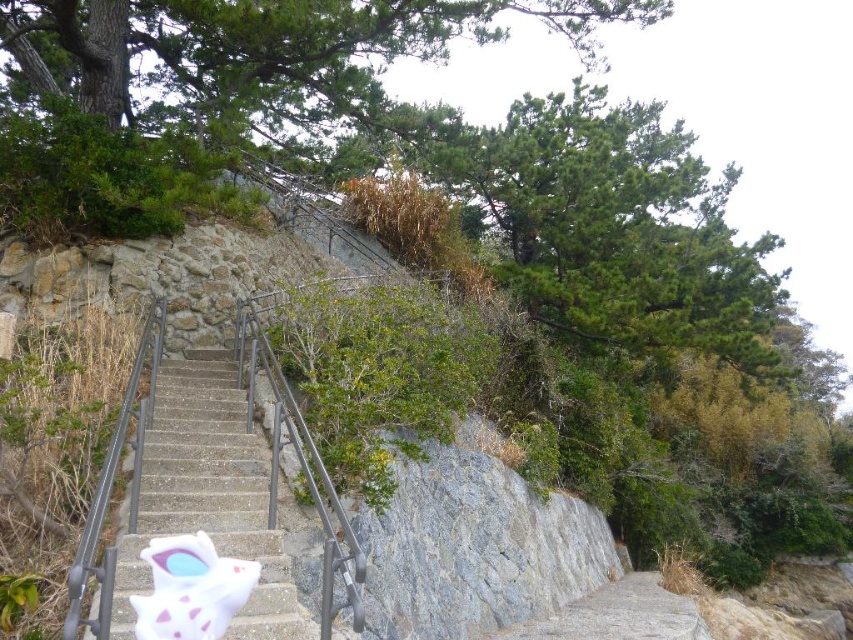
From the picture: Can you confirm if green leafy tree at upper center is positioned above concrete stairs at center?

Indeed, green leafy tree at upper center is positioned over concrete stairs at center.

Where is `green leafy tree at upper center`? green leafy tree at upper center is located at coordinates tap(610, 225).

Can you confirm if green textured tree at upper center is shorter than green leafy tree at upper center?

In fact, green textured tree at upper center may be taller than green leafy tree at upper center.

Can you confirm if green textured tree at upper center is positioned below green leafy tree at upper center?

No, green textured tree at upper center is not below green leafy tree at upper center.

Is point (235, 84) farther from viewer compared to point (781, 362)?

No.

Where is `green textured tree at upper center`? This screenshot has height=640, width=853. green textured tree at upper center is located at coordinates (229, 97).

Does green textured tree at upper center have a lesser width compared to concrete stairs at center?

No.

Does green textured tree at upper center appear on the left side of concrete stairs at center?

Incorrect, green textured tree at upper center is not on the left side of concrete stairs at center.

Is point (328, 68) positioned after point (235, 531)?

Yes.

Where is `green textured tree at upper center`? Image resolution: width=853 pixels, height=640 pixels. green textured tree at upper center is located at coordinates (229, 97).